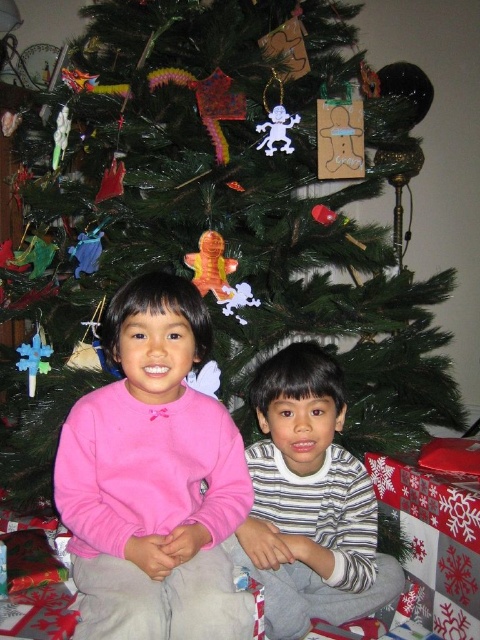
Between point (208, 502) and point (307, 454), which one is positioned behind?

The point (307, 454) is behind.

Between point (144, 392) and point (327, 541), which one is positioned behind?

Point (327, 541)

You are a GUI agent. You are given a task and a screenshot of the screen. Output one action in this format:
    pyautogui.click(x=<x>, y=<y>)
    Task: Click on the pink fleece sweater at center
    
    Given the screenshot: What is the action you would take?
    pyautogui.click(x=154, y=480)